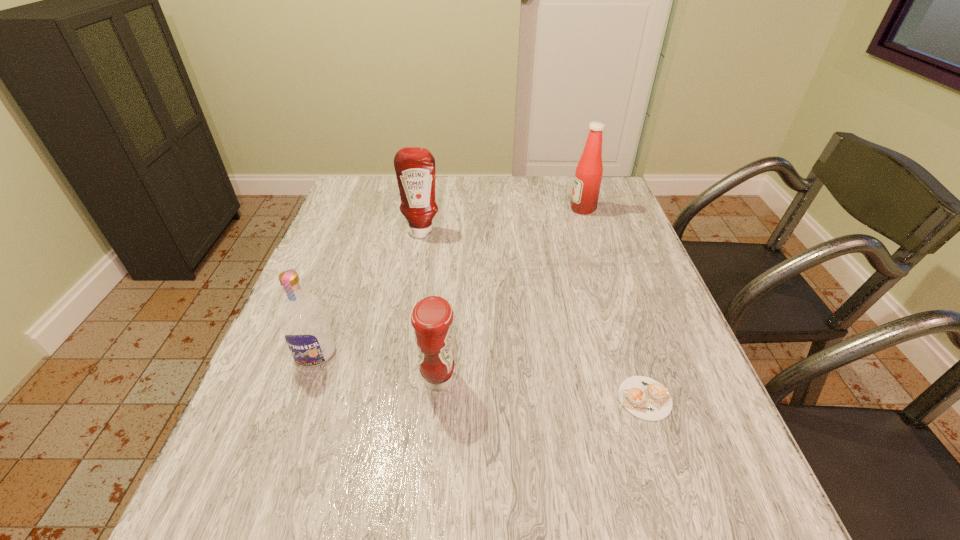
The width and height of the screenshot is (960, 540). In order to click on vacant space situated on the label of the vodka in this screenshot , I will do click(x=268, y=486).

The height and width of the screenshot is (540, 960). I want to click on vacant space located 0.170m on the back of the shortest condiment, so click(445, 304).

Locate an element on the screen. The height and width of the screenshot is (540, 960). free spot located 0.240m on the back of the shortest object is located at coordinates (612, 296).

You are a GUI agent. You are given a task and a screenshot of the screen. Output one action in this format:
    pyautogui.click(x=<x>, y=<y>)
    Task: Click on the object that is positioned at the far edge
    The width and height of the screenshot is (960, 540).
    Given the screenshot: What is the action you would take?
    pyautogui.click(x=588, y=176)

Identify the location of object at the left edge. The image size is (960, 540). (302, 317).

What are the coordinates of `condiment located in the right edge section of the desktop` in the screenshot? It's located at (588, 176).

This screenshot has width=960, height=540. I want to click on cappuccino located at the right edge, so click(x=645, y=398).

Locate an element on the screen. object at the far right corner is located at coordinates (588, 176).

Image resolution: width=960 pixels, height=540 pixels. In the image, there is a desktop. What are the coordinates of `vacant space at the far edge` in the screenshot? It's located at (536, 199).

Locate an element on the screen. vacant space at the left edge of the desktop is located at coordinates pos(350,298).